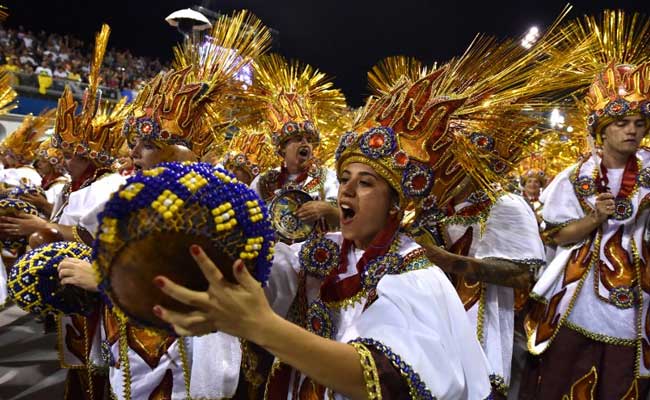
You are a GUI agent. You are given a task and a screenshot of the screen. Output one action in this format:
    pyautogui.click(x=<x>, y=<y>)
    Task: Click on the inside of bowl
    This screenshot has width=650, height=400.
    Given the screenshot: What is the action you would take?
    pyautogui.click(x=294, y=234)